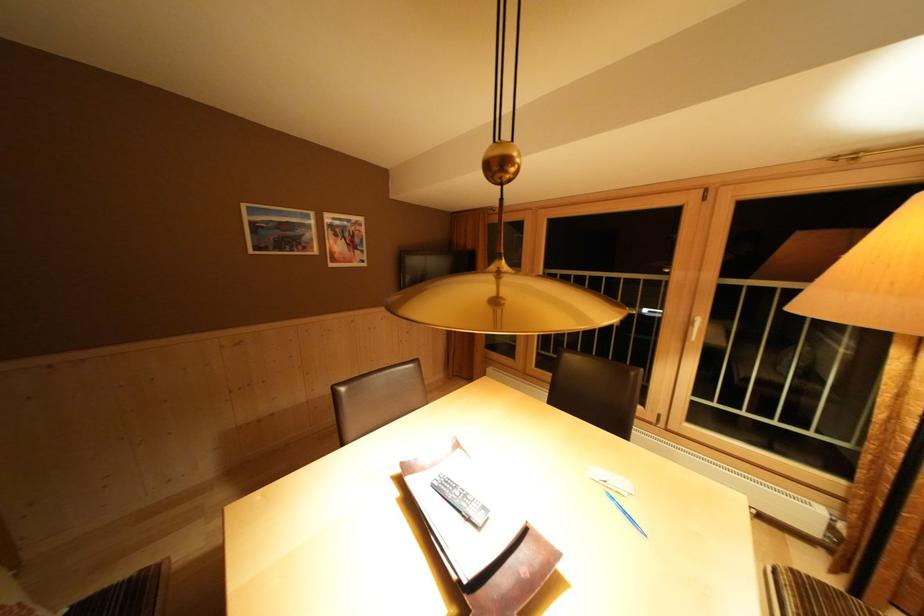
At what (x,y) coordinates should I click in order to perform the action: click on lamp height adjuster. Please return your answer as a coordinate pair (x, y). The width and height of the screenshot is (924, 616). Looking at the image, I should click on (575, 52).